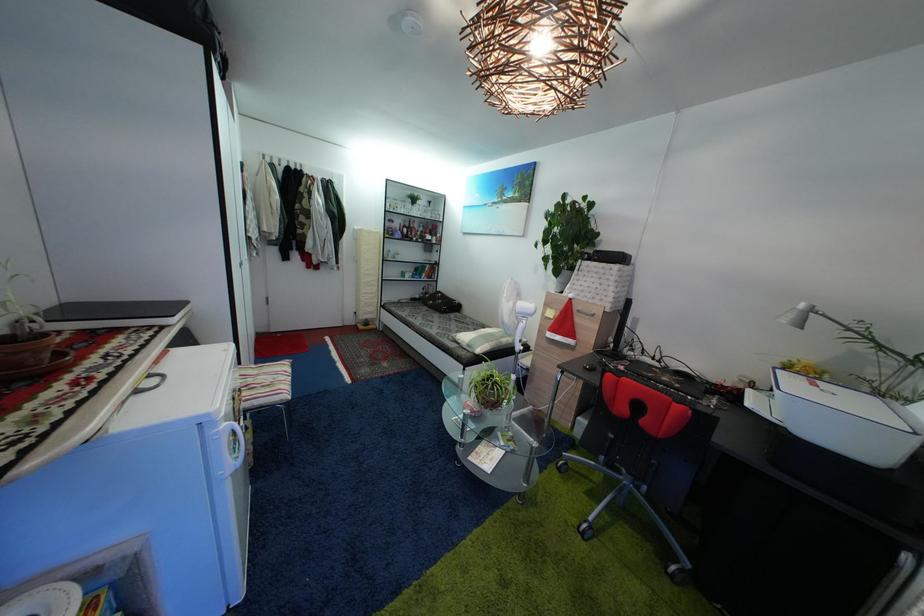
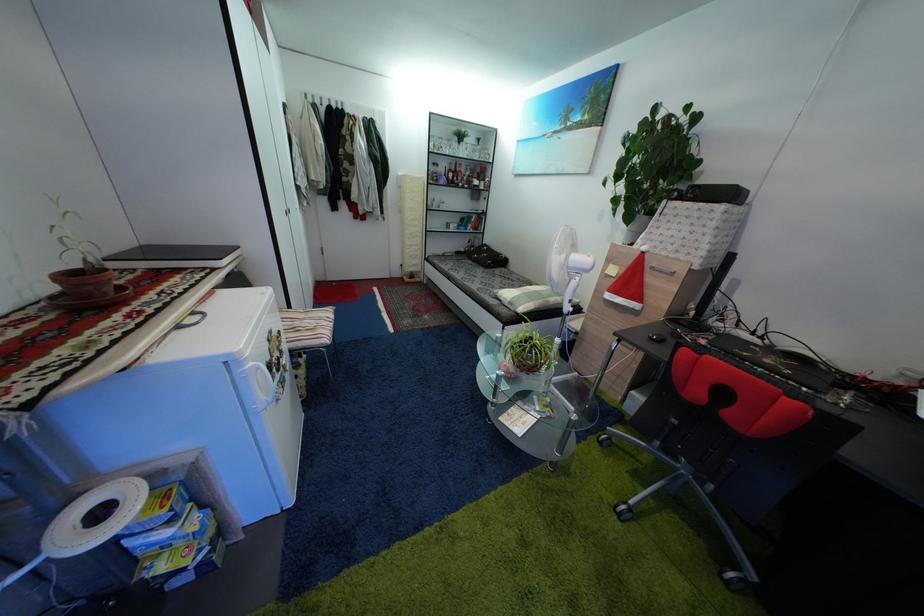
The point at (585, 314) is marked in the first image. Where is the corresponding point in the second image?

(659, 270)